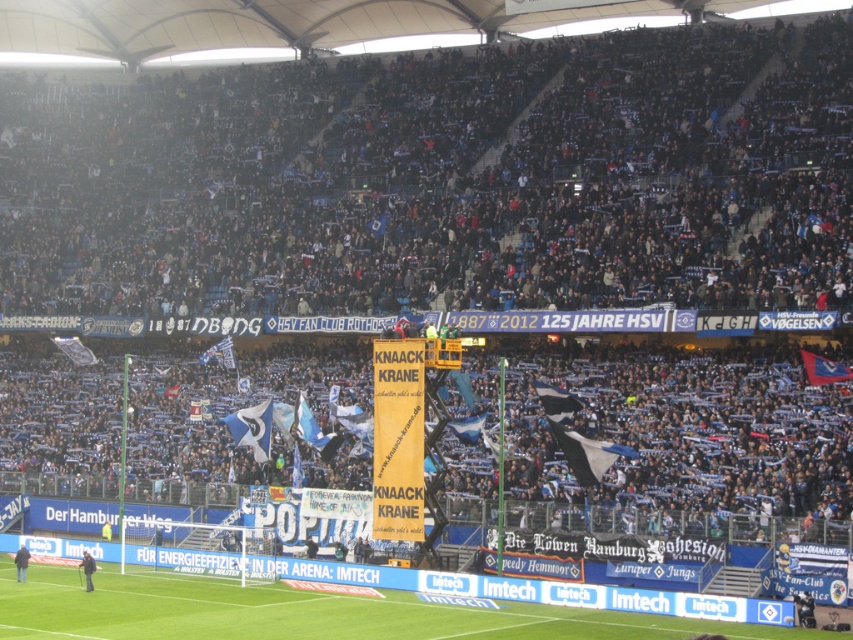
Can you confirm if dark blue fabric crowd at upper center is taller than blue fabric flag at center?

Indeed, dark blue fabric crowd at upper center has a greater height compared to blue fabric flag at center.

Can you confirm if dark blue fabric crowd at upper center is wider than blue fabric flag at center?

Yes.

Does point (697, 161) come in front of point (239, 410)?

No.

Identify the location of dark blue fabric crowd at upper center. (427, 179).

Is green grass football field at lower center smaller than blue fabric flag at center?

Incorrect, green grass football field at lower center is not smaller in size than blue fabric flag at center.

Who is more forward, [148,630] or [260,449]?

Point [148,630] is more forward.

Is point (281, 600) positioned after point (248, 445)?

No.

You are a GUI agent. You are given a task and a screenshot of the screen. Output one action in this format:
    pyautogui.click(x=<x>, y=<y>)
    Task: Click on the green grass football field at lower center
    The image size is (853, 640).
    Given the screenshot: What is the action you would take?
    click(299, 611)

Can you confirm if dark blue fabric crowd at upper center is thinner than green grass football field at lower center?

No, dark blue fabric crowd at upper center is not thinner than green grass football field at lower center.

Who is higher up, dark blue fabric crowd at upper center or green grass football field at lower center?

dark blue fabric crowd at upper center is higher up.

Is point (532, 236) positioned behind point (1, 556)?

Yes, point (532, 236) is behind point (1, 556).

You are a GUI agent. You are given a task and a screenshot of the screen. Output one action in this format:
    pyautogui.click(x=<x>, y=<y>)
    Task: Click on the dark blue fabric crowd at upper center
    This screenshot has height=640, width=853.
    Given the screenshot: What is the action you would take?
    pyautogui.click(x=427, y=179)